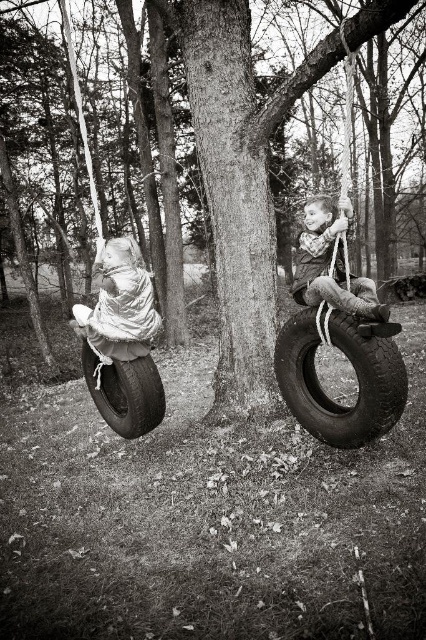
Does rubber tire swing at left come in front of white fabric-covered object at left?

Yes, it is in front of white fabric-covered object at left.

Find the location of a particular element. rubber tire swing at left is located at coordinates (123, 381).

Where is `rubber tire swing at left`? rubber tire swing at left is located at coordinates (123, 381).

Is point (296, 387) closer to viewer compared to point (385, 332)?

No, (296, 387) is further to viewer.

Measure the distance between smooth bark tree at center and rubber/soft tire at right.

smooth bark tree at center and rubber/soft tire at right are 9.97 feet apart from each other.

What do you see at coordinates (356, 372) in the screenshot?
I see `smooth bark tree at center` at bounding box center [356, 372].

The height and width of the screenshot is (640, 426). I want to click on smooth bark tree at center, so click(x=356, y=372).

Looking at this image, can you confirm if rubber/soft tire at right is bigger than rubber tire swing at left?

Incorrect, rubber/soft tire at right is not larger than rubber tire swing at left.

Is point (344, 344) more distant than point (112, 369)?

No, (344, 344) is closer to viewer.

Which is in front, point (331, 316) or point (127, 308)?

Point (331, 316)

You are a GUI agent. You are given a task and a screenshot of the screen. Output one action in this format:
    pyautogui.click(x=<x>, y=<y>)
    Task: Click on the rubber/soft tire at right
    The width and height of the screenshot is (426, 640).
    Given the screenshot: What is the action you would take?
    pyautogui.click(x=356, y=376)